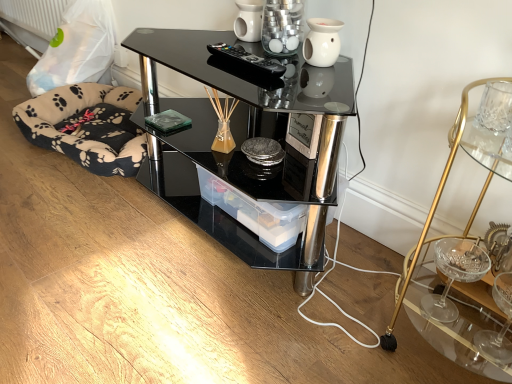
Identify the location of vacant space underneath gold metallic cocktail table at right (from a real-world perspective). This screenshot has height=384, width=512. (438, 333).